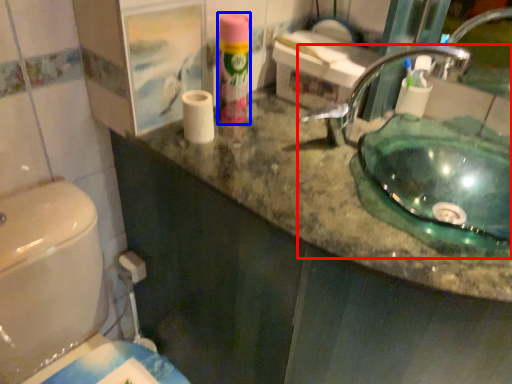
Question: Among these objects, which one is farthest to the camera, sink (highlighted by a red box) or cleaning product (highlighted by a blue box)?

Choices:
 (A) sink
 (B) cleaning product

Answer: (B)